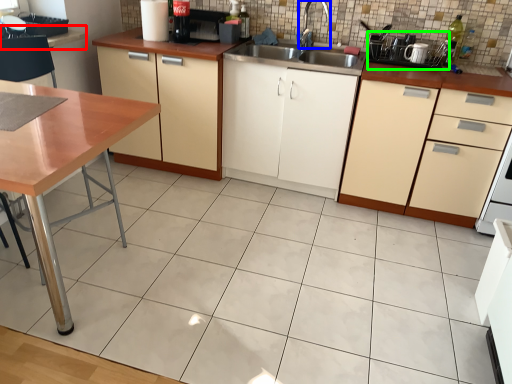
Question: Estimate the real-world distances between objects in this image. Which object is farther from counter top (highlighted by a red box), faucet (highlighted by a blue box) or appliance (highlighted by a green box)?

Choices:
 (A) faucet
 (B) appliance

Answer: (B)